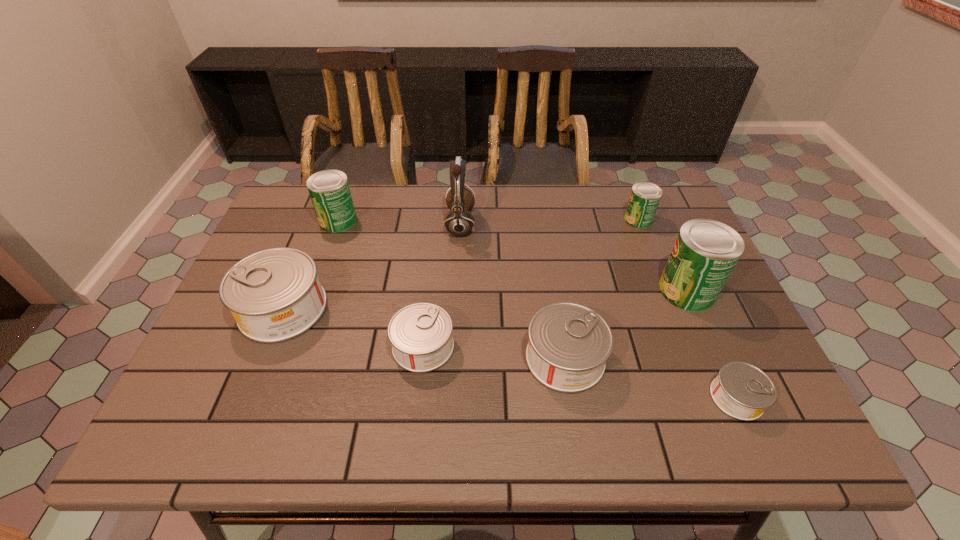
Where is `vacant area situated on the right of the second silver can from left to right`? The image size is (960, 540). vacant area situated on the right of the second silver can from left to right is located at coordinates (528, 346).

Where is `vacant space located 0.250m on the left of the shortest object`? vacant space located 0.250m on the left of the shortest object is located at coordinates (592, 397).

At what (x,y) coordinates should I click in order to perform the action: click on earphone at the far edge. Please return your answer as a coordinate pair (x, y). Looking at the image, I should click on (459, 221).

What are the coordinates of `object at the near edge` in the screenshot? It's located at (742, 391).

Find the location of a particular element. Image resolution: width=960 pixels, height=540 pixels. object at the far left corner is located at coordinates (329, 190).

Locate an element on the screen. The width and height of the screenshot is (960, 540). object positioned at the far right corner is located at coordinates (644, 199).

At what (x,y) coordinates should I click in order to perform the action: click on object that is at the near right corner. Please return your answer as a coordinate pair (x, y). The width and height of the screenshot is (960, 540). Looking at the image, I should click on (742, 391).

Where is `vacant space at the far edge of the desktop`? This screenshot has height=540, width=960. vacant space at the far edge of the desktop is located at coordinates tap(449, 184).

I want to click on vacant area at the near edge of the desktop, so click(x=309, y=430).

In the image, there is a desktop. Identify the location of vacant space at the far left corner. This screenshot has height=540, width=960. (275, 224).